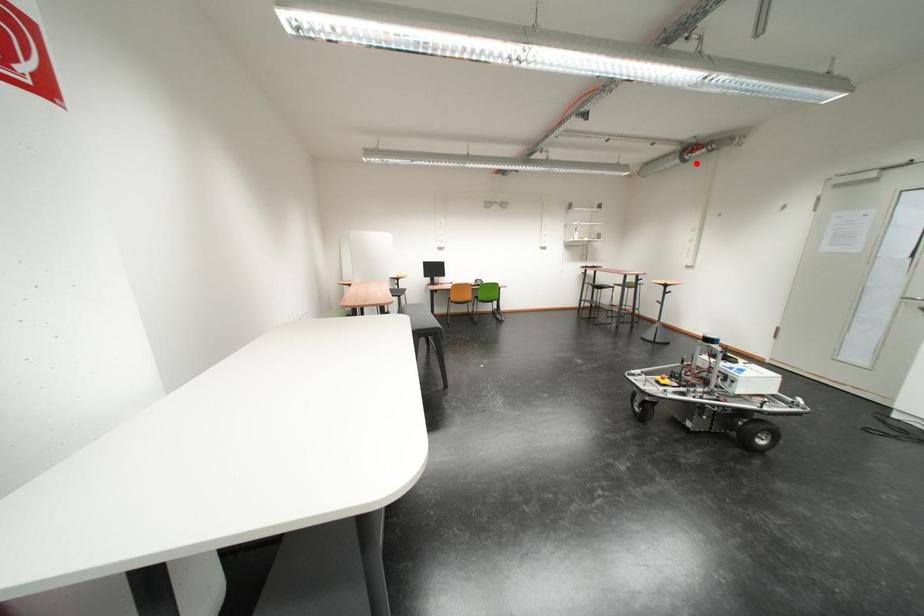
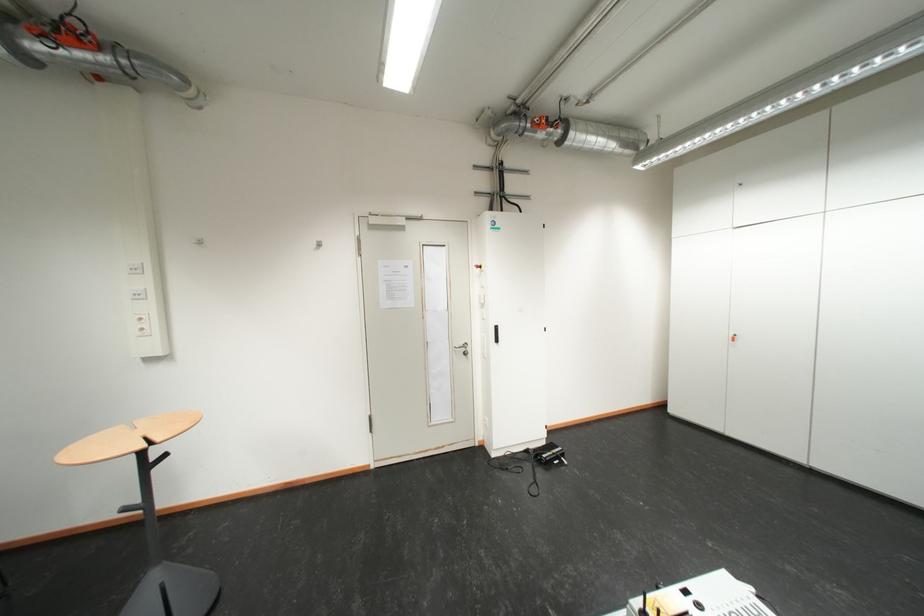
Where in the second image is the point corresponding to the highlighted location from the first image?

(35, 60)